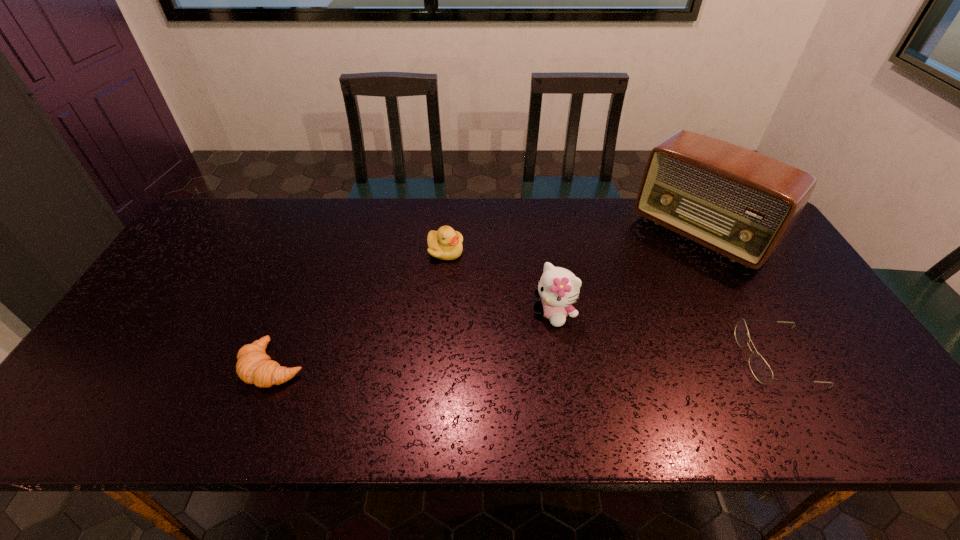
Locate an element on the screen. The width and height of the screenshot is (960, 540). free spot located 0.160m on the front-facing side of the spectacles is located at coordinates (677, 357).

This screenshot has width=960, height=540. In order to click on free space located on the front-facing side of the kitten in this screenshot , I will do `click(506, 362)`.

Where is `free space located on the front-facing side of the kitten`? Image resolution: width=960 pixels, height=540 pixels. free space located on the front-facing side of the kitten is located at coordinates (520, 347).

Identify the location of free space located 0.050m on the front-facing side of the kitten. (530, 337).

Locate an element on the screen. The image size is (960, 540). vacant point located 0.170m on the beak of the third shortest object is located at coordinates (466, 303).

Where is `vacant space located on the beak of the third shortest object`? vacant space located on the beak of the third shortest object is located at coordinates (472, 319).

Where is `vacant region located on the beak of the third shortest object`? The image size is (960, 540). vacant region located on the beak of the third shortest object is located at coordinates (462, 293).

This screenshot has height=540, width=960. What are the coordinates of `free space located on the front-facing side of the radio receiver` in the screenshot? It's located at (598, 335).

Locate an element on the screen. This screenshot has width=960, height=540. vacant point located on the front-facing side of the radio receiver is located at coordinates (628, 306).

This screenshot has width=960, height=540. In order to click on vacant space located 0.140m on the front-facing side of the radio receiver in this screenshot , I will do `click(645, 289)`.